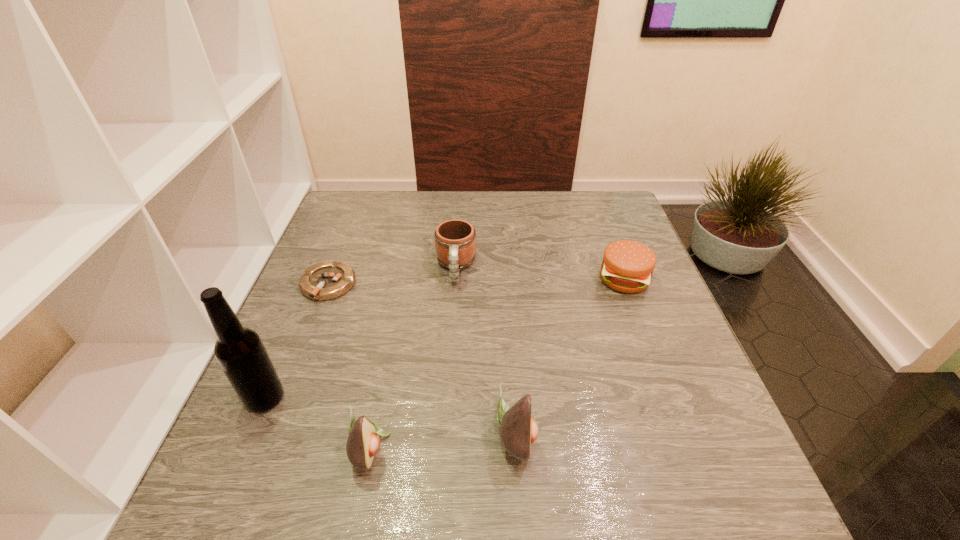
Please show where to add a avocado on the right while keeping spacing even. Please provide its 2D coordinates. Your answer should be formatted as a tuple, i.e. [(x, y)], where the tuple contains the x and y coordinates of a point satisfying the conditions above.

[(657, 422)]